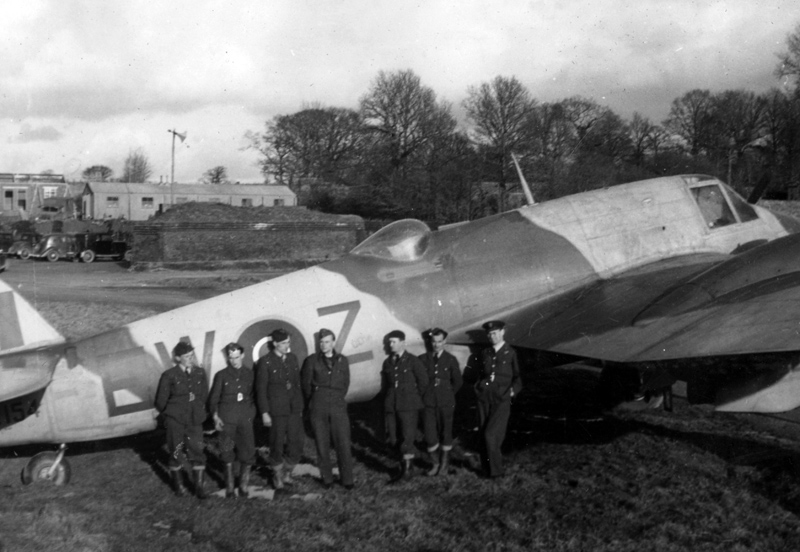
You are a GUI agent. You are given a task and a screenshot of the screen. Output one action in this format:
    pyautogui.click(x=<x>, y=<y>)
    Task: Click on the wall
    This screenshot has width=800, height=552.
    Given the screenshot: What is the action you would take?
    pyautogui.click(x=198, y=245), pyautogui.click(x=146, y=242)